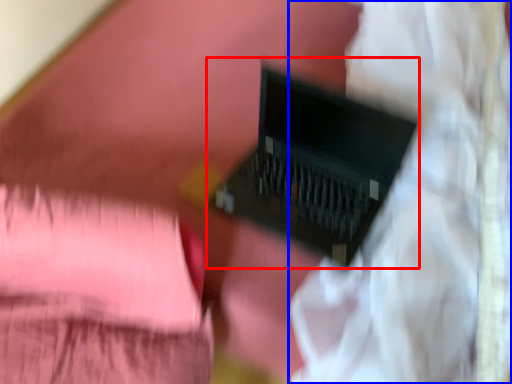
Question: Among these objects, which one is nearest to the camera, computer (highlighted by a red box) or curtain (highlighted by a blue box)?

Choices:
 (A) computer
 (B) curtain

Answer: (B)